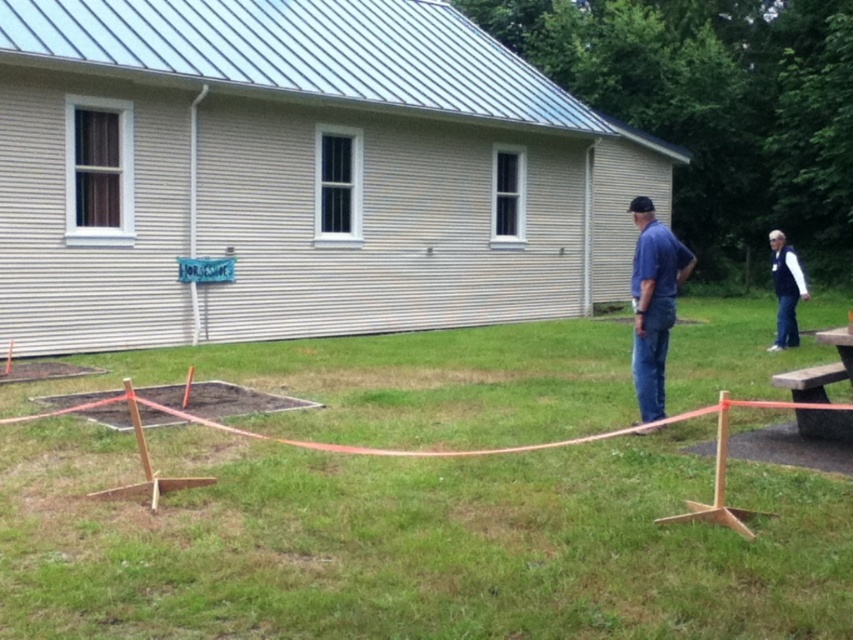
Question: Which point is closer to the camera?

Choices:
 (A) blue denim jeans at center
 (B) green grass at center

Answer: (B)

Question: Considering the real-world distances, which object is farthest from the green grass at center?

Choices:
 (A) wooden picnic table at right
 (B) navy blue jacket at lower right

Answer: (B)

Question: Which object is closer to the camera taking this photo?

Choices:
 (A) green grass at center
 (B) wooden picnic table at right
 (C) navy blue jacket at lower right

Answer: (A)

Question: Does blue denim jeans at center appear under wooden picnic table at right?

Choices:
 (A) yes
 (B) no

Answer: (B)

Question: Does wooden picnic table at right appear on the left side of navy blue jacket at lower right?

Choices:
 (A) yes
 (B) no

Answer: (A)

Question: Is green grass at center closer to camera compared to blue denim jeans at center?

Choices:
 (A) yes
 (B) no

Answer: (A)